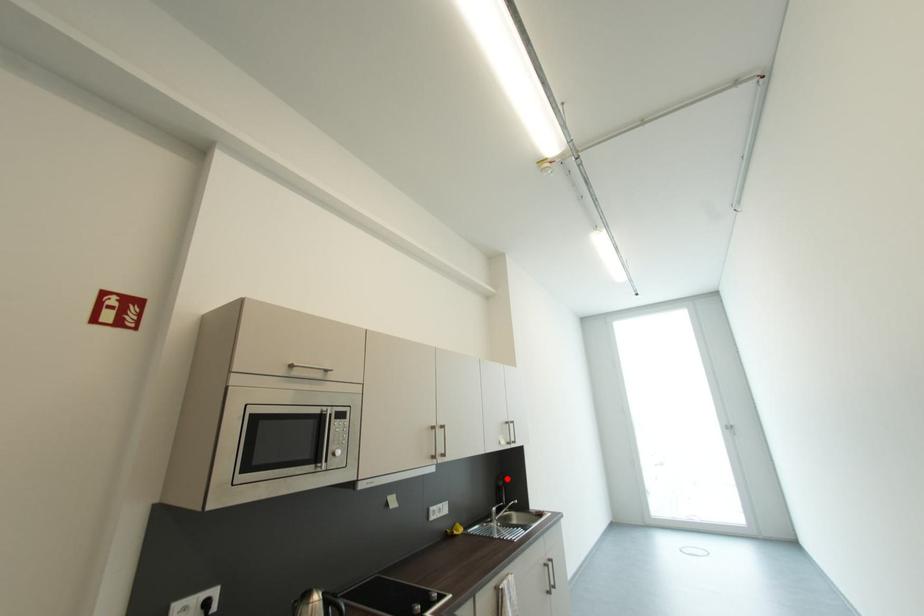
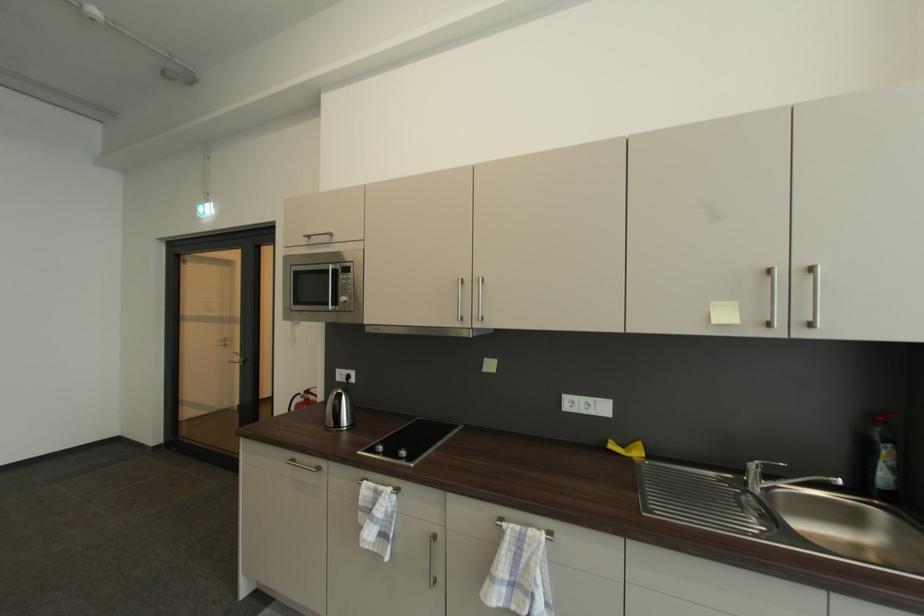
Question: I am providing you with two images of the same scene from different viewpoints. In image1, a red point is highlighted. Considering the same 3D point in image2, which of the following is correct?

Choices:
 (A) It is closer
 (B) It is farther

Answer: (A)